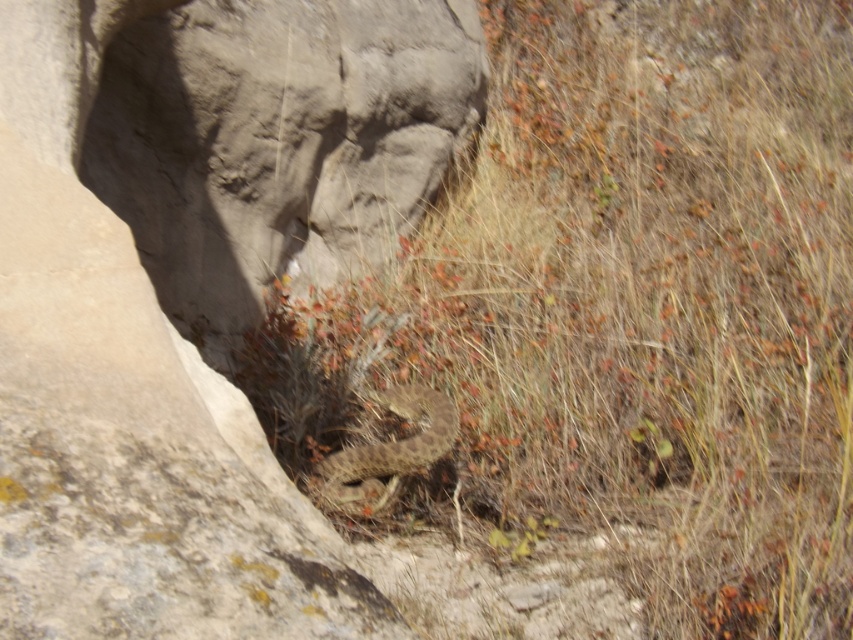
You are an explorer navigating through the rocky terrain and need to step over an obstacle. You see the brown dry grass at center and the brown scaly snake at center. Which one is closer to you, and should you be cautious about stepping over?

The brown dry grass at center is in front of the brown scaly snake at center, so it is closer. However, you should still be cautious of the brown scaly snake at center as it might be hidden behind the grass.

You are a hiker who has spotted both the brown dry grass at center and the brown scaly snake at center in the rocky environment. You need to place a warning sign between them to alert others about the snake. Is there enough space to place the sign without it overlapping either object?

The brown dry grass at center and brown scaly snake at center are 38.72 inches apart. Since the sign would need some space around it to avoid overlapping, and 38.72 inches is a sufficient distance, you can place the sign between them without overlapping either object.